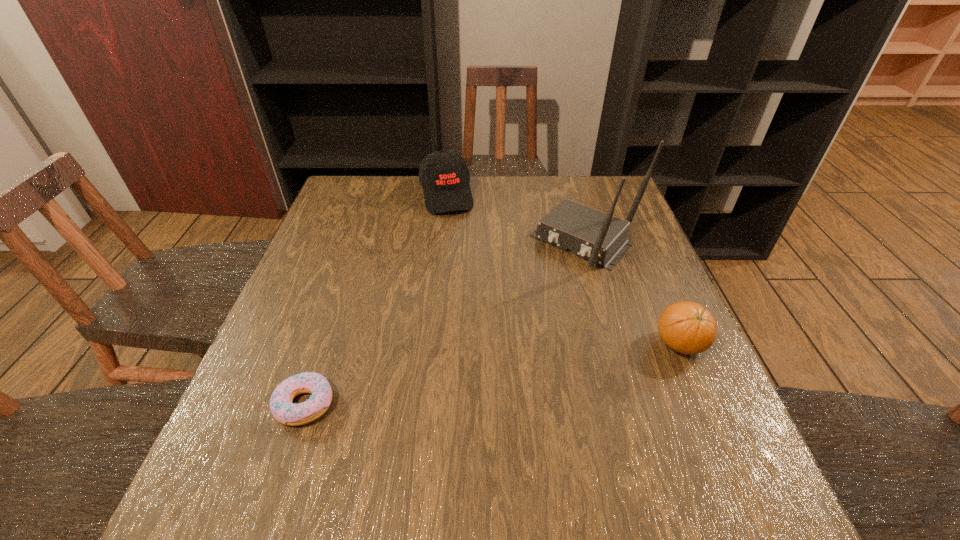
In order to click on object present at the near left corner in this screenshot , I will do `click(283, 410)`.

At what (x,y) coordinates should I click in order to perform the action: click on object present at the far right corner. Please return your answer as a coordinate pair (x, y). The width and height of the screenshot is (960, 540). Looking at the image, I should click on (601, 238).

The height and width of the screenshot is (540, 960). In the image, there is a desktop. In order to click on vacant space at the far edge in this screenshot , I will do `click(527, 200)`.

This screenshot has width=960, height=540. I want to click on vacant point at the near edge, so click(x=408, y=450).

What are the coordinates of `free space at the left edge` in the screenshot? It's located at (341, 267).

Where is `vacant space at the right edge`? This screenshot has width=960, height=540. vacant space at the right edge is located at coordinates (631, 269).

At what (x,y) coordinates should I click in order to perform the action: click on free space at the far left corner of the desktop. Please return your answer as a coordinate pair (x, y). This screenshot has width=960, height=540. Looking at the image, I should click on (380, 187).

The image size is (960, 540). Identify the location of blank space at the far right corner of the desktop. (627, 211).

In the image, there is a desktop. At what (x,y) coordinates should I click in order to perform the action: click on vacant space at the near right corner. Please return your answer as a coordinate pair (x, y). Looking at the image, I should click on (726, 430).

Identify the location of free space between the router and the leftmost object. Image resolution: width=960 pixels, height=540 pixels. (444, 323).